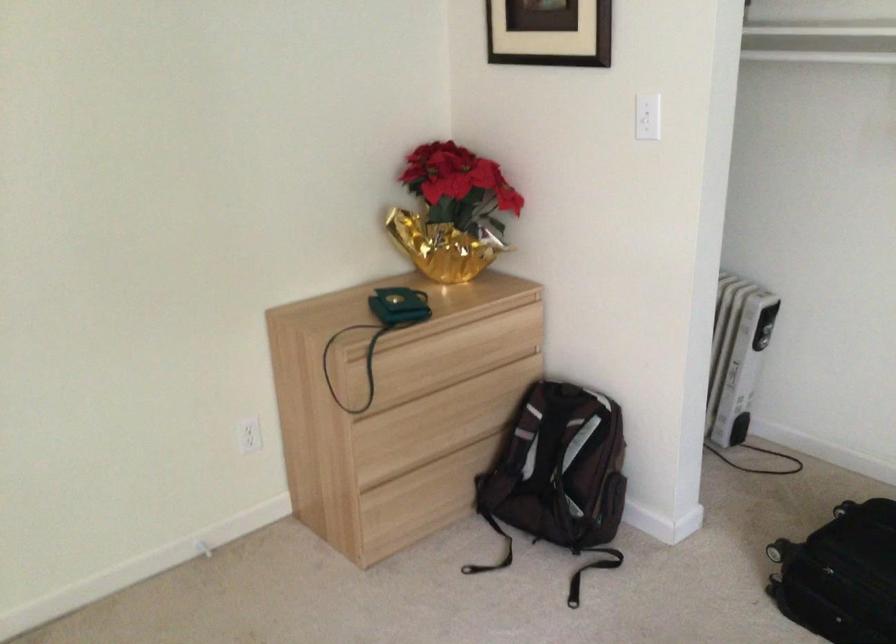
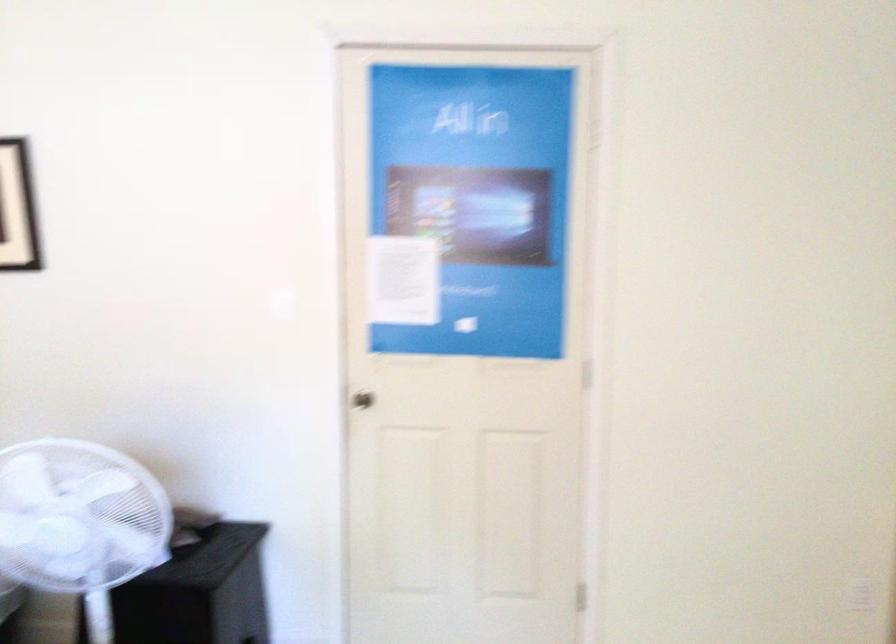
Question: The first image is from the beginning of the video and the second image is from the end. How did the camera likely rotate when shooting the video?

Choices:
 (A) Left
 (B) Right
 (C) Up
 (D) Down

Answer: (A)